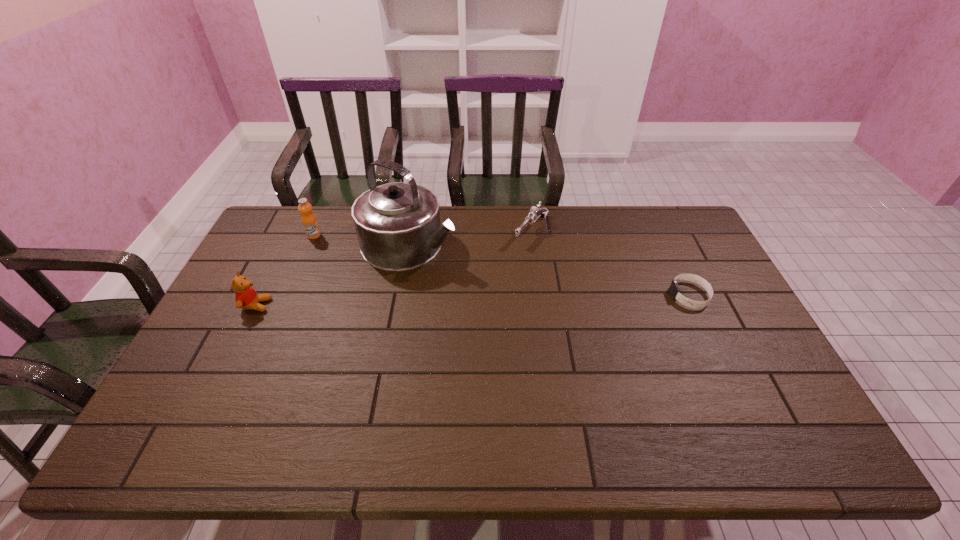
Where is `vacant area that lies between the leftmost object and the orange juice`? This screenshot has width=960, height=540. vacant area that lies between the leftmost object and the orange juice is located at coordinates (285, 270).

Locate an element on the screen. The image size is (960, 540). vacant region between the tallest object and the third tallest object is located at coordinates (333, 274).

You are a GUI agent. You are given a task and a screenshot of the screen. Output one action in this format:
    pyautogui.click(x=<x>, y=<y>)
    Task: Click on the vacant space in between the shortest object and the fourth object from left to right
    
    Given the screenshot: What is the action you would take?
    pyautogui.click(x=611, y=262)

At what (x,y) coordinates should I click in order to perform the action: click on empty location between the third shortest object and the third object from right to left. Please return your answer as a coordinate pair (x, y). Looking at the image, I should click on (333, 274).

Locate an element on the screen. This screenshot has height=540, width=960. object identified as the closest to the third tallest object is located at coordinates (398, 227).

Locate which object is the fourth closest to the teddy bear. Please provide its 2D coordinates. Your answer should be formatted as a tuple, i.e. [(x, y)], where the tuple contains the x and y coordinates of a point satisfying the conditions above.

[(674, 289)]

Identify the location of vacant space that satisfies the following two spatial constraints: 1. on the back side of the kettle; 2. on the left side of the second shortest object. Image resolution: width=960 pixels, height=540 pixels. (412, 230).

Image resolution: width=960 pixels, height=540 pixels. What are the coordinates of `free space that satisfies the following two spatial constraints: 1. on the front side of the third object from left to right; 2. on the outer surface of the rightmost object` in the screenshot? It's located at (400, 295).